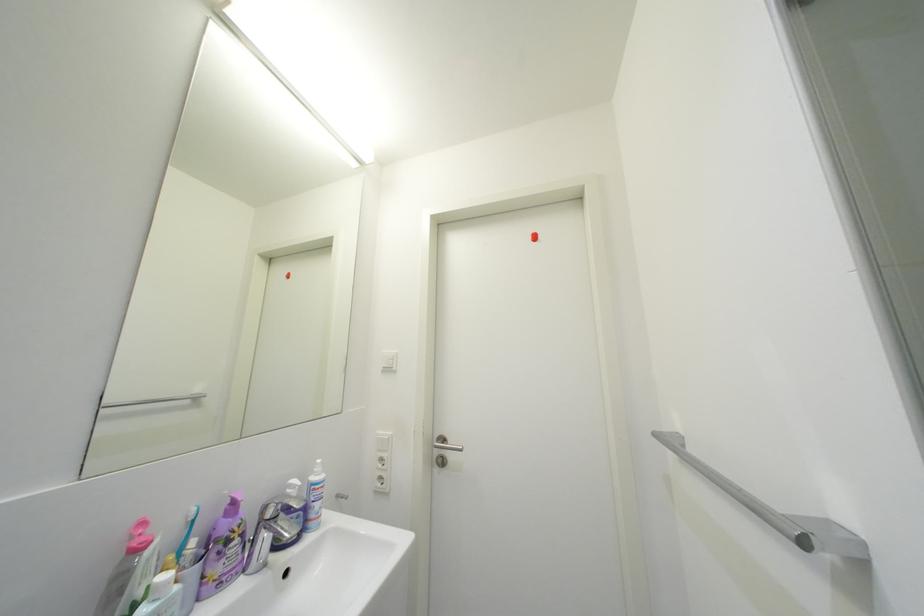
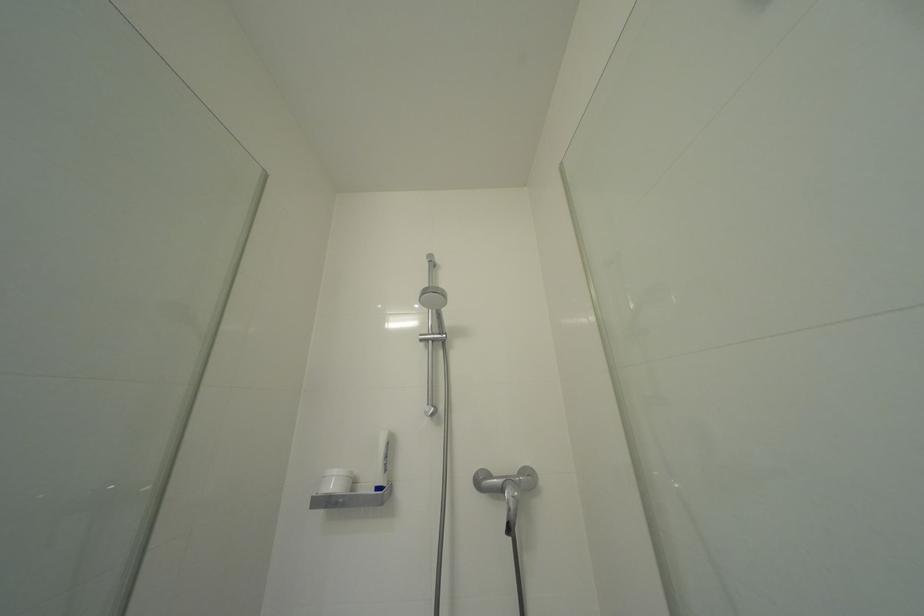
First-person continuous shooting, in which direction is the camera rotating?

The rotation direction of the camera is right-up.